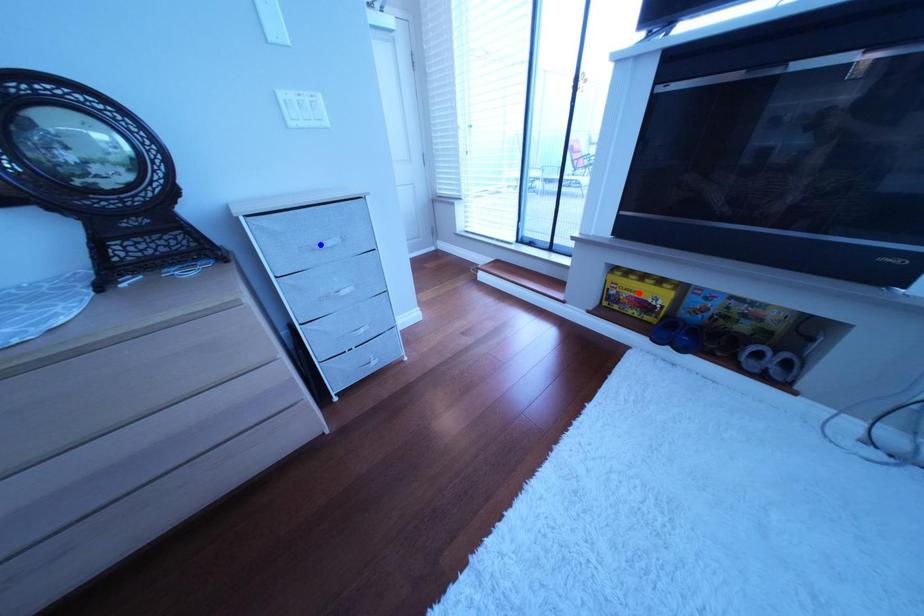
Question: Two points are marked on the image. Which point is closer to the camera?

Choices:
 (A) Blue point is closer.
 (B) Red point is closer.

Answer: (A)